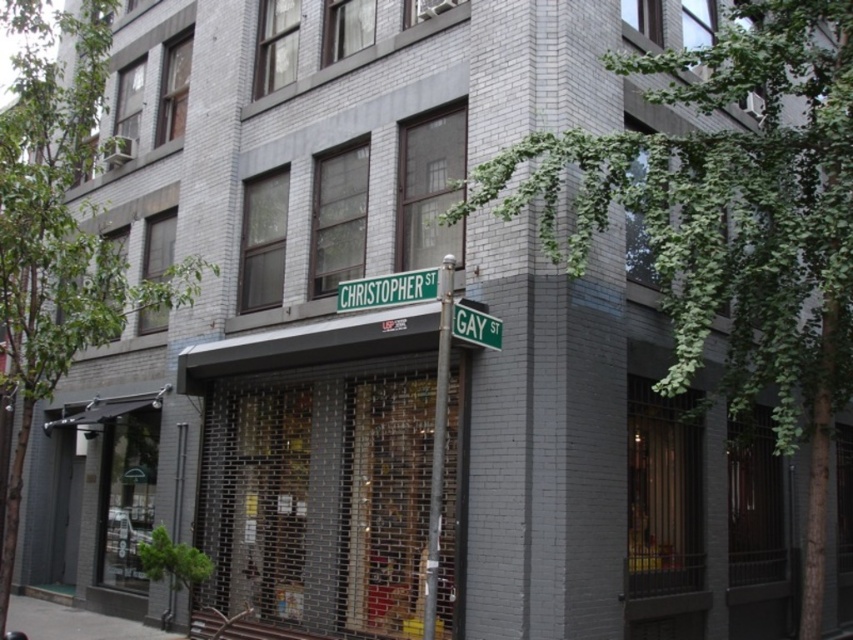
Question: Which object appears farthest from the camera in this image?

Choices:
 (A) green leafy tree at left
 (B) metallic pole at center
 (C) green metallic street sign at upper center

Answer: (A)

Question: Considering the real-world distances, which object is farthest from the green leafy tree at left?

Choices:
 (A) metallic pole at center
 (B) green metallic street sign at upper center
 (C) green leafy tree at upper right
 (D) gray concrete pavement at lower left

Answer: (A)

Question: Does green leafy tree at upper right appear on the right side of green metallic street sign at upper center?

Choices:
 (A) no
 (B) yes

Answer: (B)

Question: Which of the following is the closest to the observer?

Choices:
 (A) (434, 456)
 (B) (32, 616)

Answer: (A)

Question: Can you confirm if green leafy tree at left is thinner than green metallic street sign at upper center?

Choices:
 (A) no
 (B) yes

Answer: (A)

Question: Can you confirm if metallic pole at center is positioned to the right of green metallic street sign at center?

Choices:
 (A) no
 (B) yes

Answer: (B)